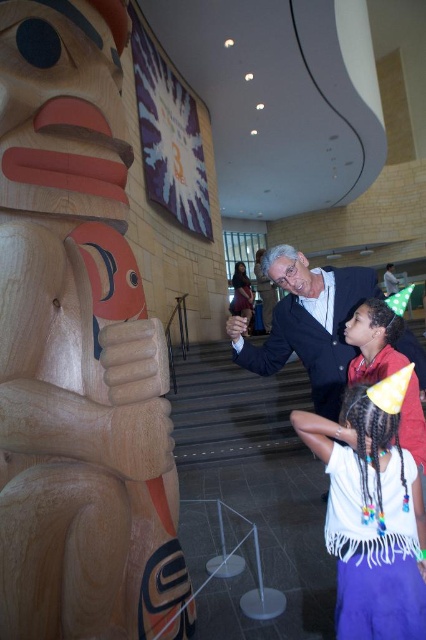
Between point (49, 461) and point (370, 632), which one is positioned in front?

Positioned in front is point (49, 461).

The image size is (426, 640). What do you see at coordinates (77, 348) in the screenshot? I see `natural wood totem pole at left` at bounding box center [77, 348].

Locate an element on the screen. The width and height of the screenshot is (426, 640). natural wood totem pole at left is located at coordinates (77, 348).

Who is taller, white fringed shirt at lower center or smooth navy suit at center?

smooth navy suit at center

Based on the photo, does white fringed shirt at lower center appear under smooth navy suit at center?

Yes, white fringed shirt at lower center is below smooth navy suit at center.

Does point (379, 468) come behind point (304, 262)?

No.

I want to click on white fringed shirt at lower center, so click(x=371, y=516).

Locate an element on the screen. natural wood totem pole at left is located at coordinates (77, 348).

This screenshot has height=640, width=426. What do you see at coordinates (77, 348) in the screenshot?
I see `natural wood totem pole at left` at bounding box center [77, 348].

Does point (57, 516) lie in front of point (244, 365)?

Yes, point (57, 516) is closer to viewer.

The width and height of the screenshot is (426, 640). Find the location of `natural wood totem pole at left`. natural wood totem pole at left is located at coordinates (77, 348).